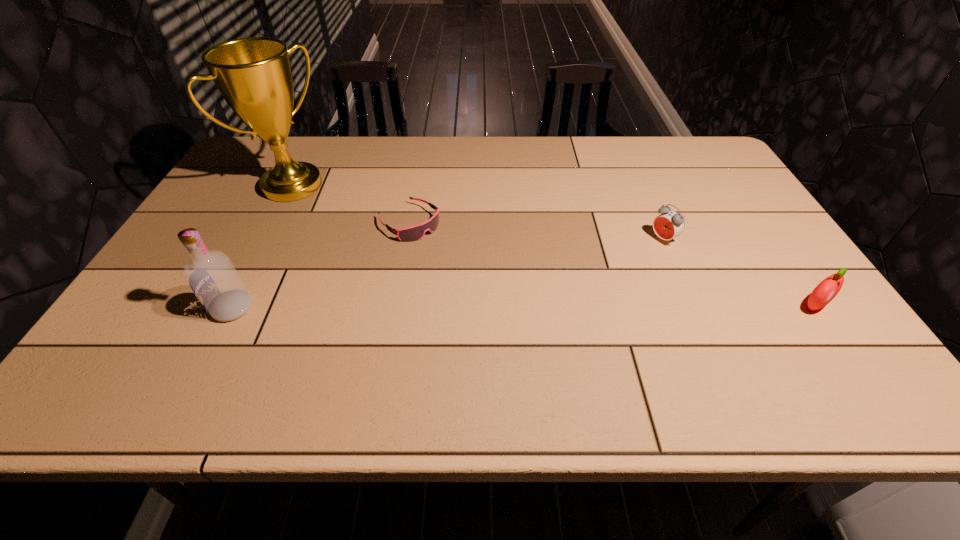
Identify which object is located as the fourth nearest to the tallest object. Please provide its 2D coordinates. Your answer should be formatted as a tuple, i.e. [(x, y)], where the tuple contains the x and y coordinates of a point satisfying the conditions above.

[(826, 290)]

This screenshot has height=540, width=960. I want to click on object that is the fourth closest one to the tallest object, so click(826, 290).

You are a GUI agent. You are given a task and a screenshot of the screen. Output one action in this format:
    pyautogui.click(x=<x>, y=<y>)
    Task: Click on the vacant space that satisfies the following two spatial constraints: 1. on the front side of the rightmost object; 2. on the right side of the award
    This screenshot has width=960, height=540.
    Given the screenshot: What is the action you would take?
    pyautogui.click(x=231, y=306)

Identify the location of free spot that satisfies the following two spatial constraints: 1. on the front side of the third object from right to left; 2. on the left side of the award. (274, 222).